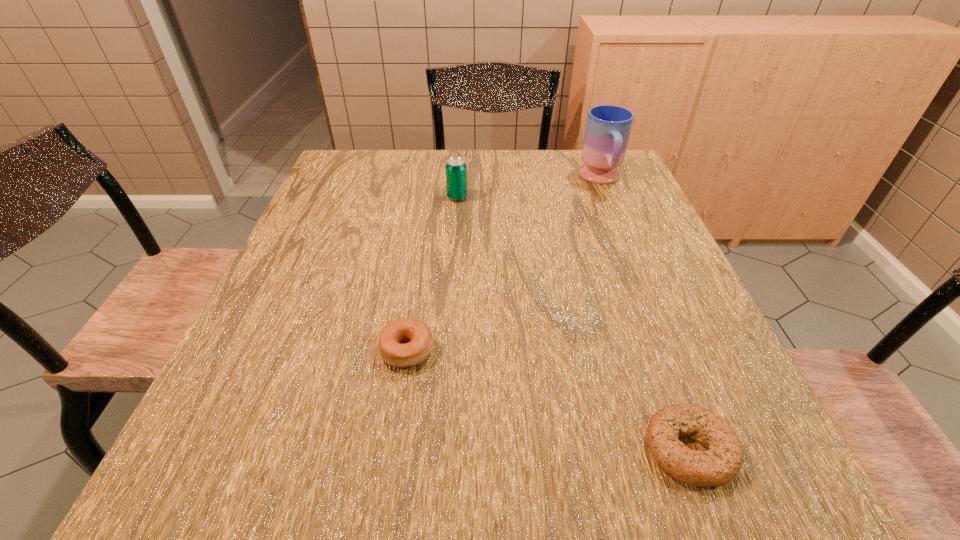
Find the location of a particular element. The image size is (960, 540). vacant region at the far left corner is located at coordinates (377, 184).

The height and width of the screenshot is (540, 960). I want to click on free space between the nearer bagel and the second tallest object, so click(573, 323).

You are a GUI agent. You are given a task and a screenshot of the screen. Output one action in this format:
    pyautogui.click(x=<x>, y=<y>)
    Task: Click on the empty location between the nearest object and the second tallest object
    
    Given the screenshot: What is the action you would take?
    pyautogui.click(x=573, y=323)

This screenshot has width=960, height=540. Find the location of `vacant region between the mug and the left bagel`. vacant region between the mug and the left bagel is located at coordinates (504, 265).

The width and height of the screenshot is (960, 540). Find the location of `free spot between the beer can and the mug`. free spot between the beer can and the mug is located at coordinates (529, 188).

The height and width of the screenshot is (540, 960). Find the location of `empty space that is in between the mug and the nearest object`. empty space that is in between the mug and the nearest object is located at coordinates pyautogui.click(x=645, y=314).

Locate an element on the screen. free space between the right bagel and the mug is located at coordinates (645, 314).

You are a GUI agent. You are given a task and a screenshot of the screen. Output one action in this format:
    pyautogui.click(x=<x>, y=<y>)
    Task: Click on the vacant space that's between the farther bagel and the beer can
    The height and width of the screenshot is (540, 960).
    Given the screenshot: What is the action you would take?
    pyautogui.click(x=432, y=274)

Locate an element on the screen. Image resolution: width=960 pixels, height=540 pixels. free space that is in between the left bagel and the beer can is located at coordinates (432, 274).

You are a GUI agent. You are given a task and a screenshot of the screen. Output one action in this format:
    pyautogui.click(x=<x>, y=<y>)
    Task: Click on the free space between the nearer bagel and the mug
    
    Given the screenshot: What is the action you would take?
    pyautogui.click(x=645, y=314)